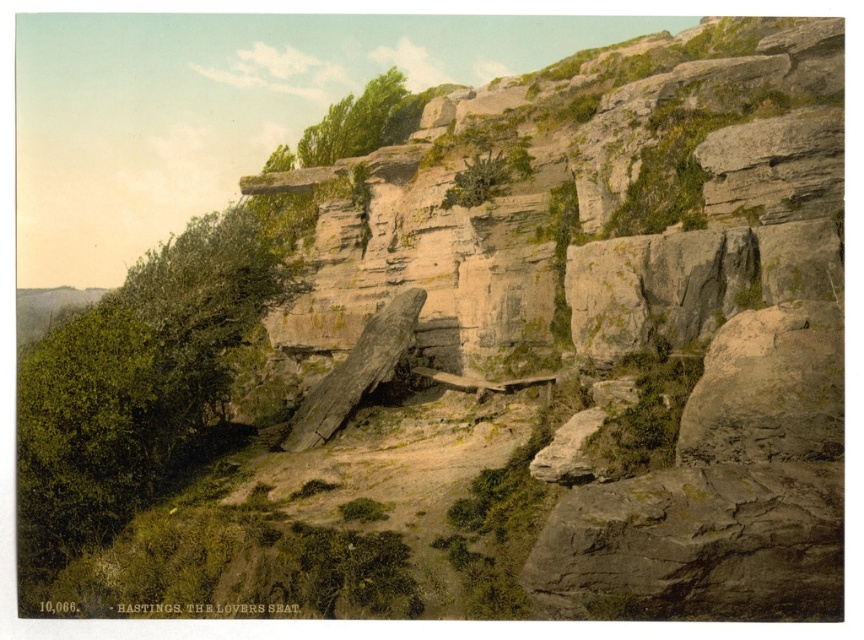
You are standing at the base of the cliff and want to determine which of the two points, point (x=97, y=500) or point (x=318, y=164), is nearer to you. Based on the image, which point is closer?

Point (x=97, y=500) is closer to the camera than point (x=318, y=164), so it is the nearer one.

You are a hiker standing at the base of the cliff and want to take a photo of both the green leafy bush at left and the green leafy tree at upper center. Can you frame both in the same shot without moving your position?

The green leafy bush at left is positioned under the green leafy tree at upper center, so you can frame both in the same shot by adjusting your camera angle to include the lower bush and the tree above it.